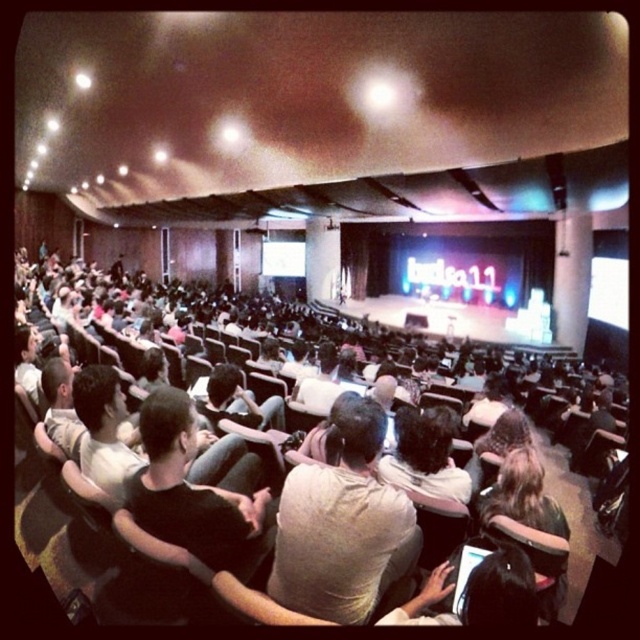
Who is more forward, [307,556] or [412,420]?

Point [307,556] is in front.

Can you confirm if light brown cotton shirt at center is shorter than light brown hair at center?

In fact, light brown cotton shirt at center may be taller than light brown hair at center.

The image size is (640, 640). I want to click on light brown cotton shirt at center, so click(342, 525).